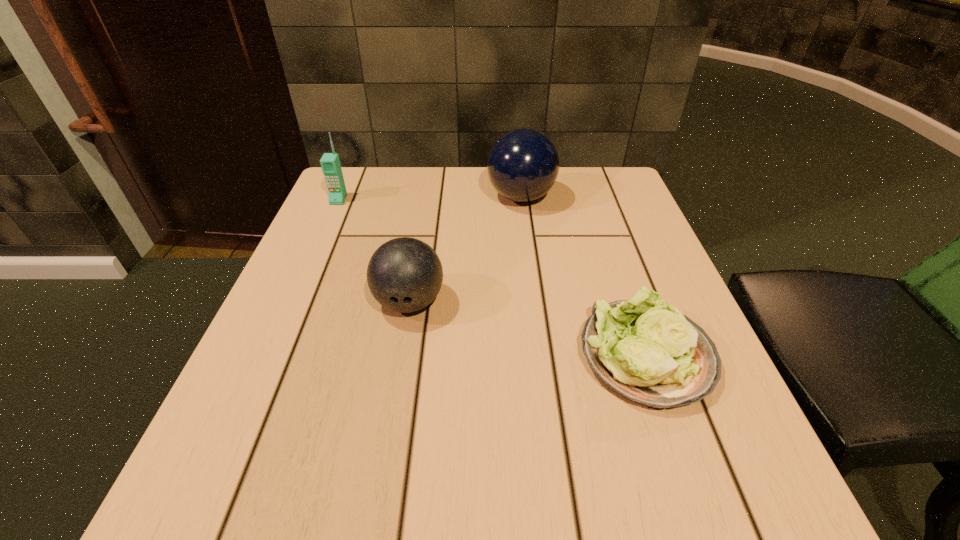
Locate an element on the screen. free space located 0.170m on the grip area of the nearer bowling ball is located at coordinates (390, 417).

I want to click on free space located 0.140m on the left of the shortest object, so click(x=494, y=356).

Locate an element on the screen. This screenshot has width=960, height=540. bowling ball that is at the far edge is located at coordinates (523, 165).

Where is `cellular telephone situated at the far edge`? This screenshot has height=540, width=960. cellular telephone situated at the far edge is located at coordinates (330, 163).

This screenshot has width=960, height=540. In order to click on object that is at the left edge in this screenshot , I will do `click(330, 163)`.

I want to click on object that is positioned at the right edge, so click(x=648, y=352).

The width and height of the screenshot is (960, 540). I want to click on object located at the far left corner, so click(330, 163).

In order to click on free space at the far edge in this screenshot , I will do point(486,173).

In the image, there is a desktop. Where is `vacant area at the near edge`? The width and height of the screenshot is (960, 540). vacant area at the near edge is located at coordinates (596, 515).

In the image, there is a desktop. In order to click on vacant space at the left edge in this screenshot , I will do `click(359, 243)`.